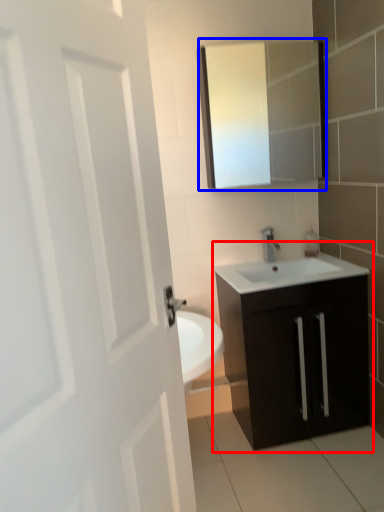
Question: Which of the following is the farthest to the observer, bathroom cabinet (highlighted by a red box) or medicine cabinet (highlighted by a blue box)?

Choices:
 (A) bathroom cabinet
 (B) medicine cabinet

Answer: (B)